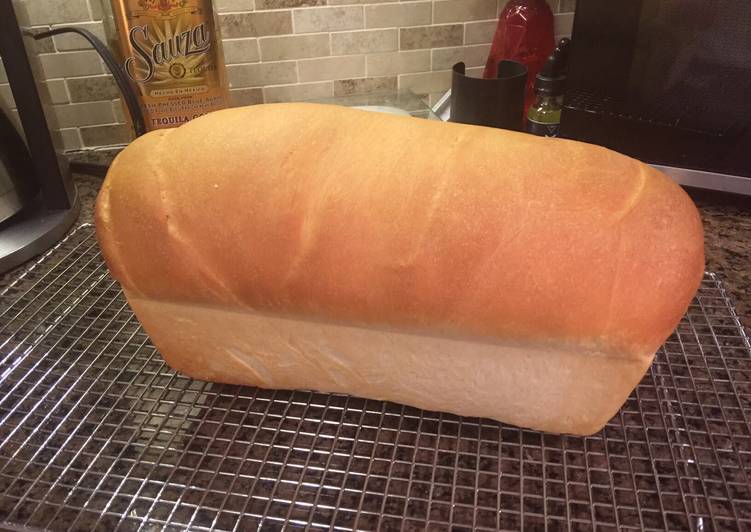
The width and height of the screenshot is (751, 532). In order to click on counter in this screenshot , I will do `click(88, 209)`.